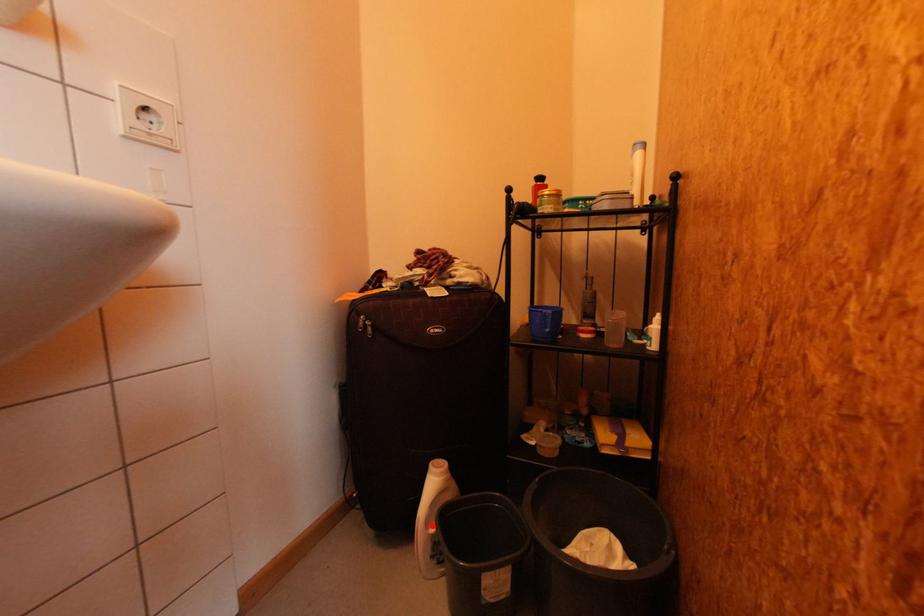
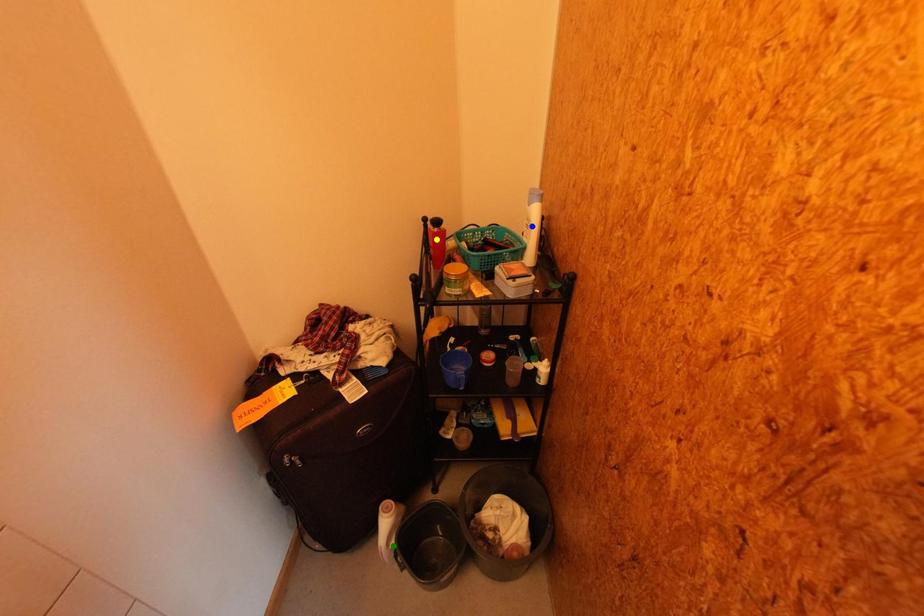
Question: I am providing you with two images of the same scene from different viewpoints. A red point is marked on the first image. You are given multiple points on the second image. In image 2, which mark is for the same physical point as the one in image 1?

Choices:
 (A) blue point
 (B) green point
 (C) yellow point

Answer: (B)